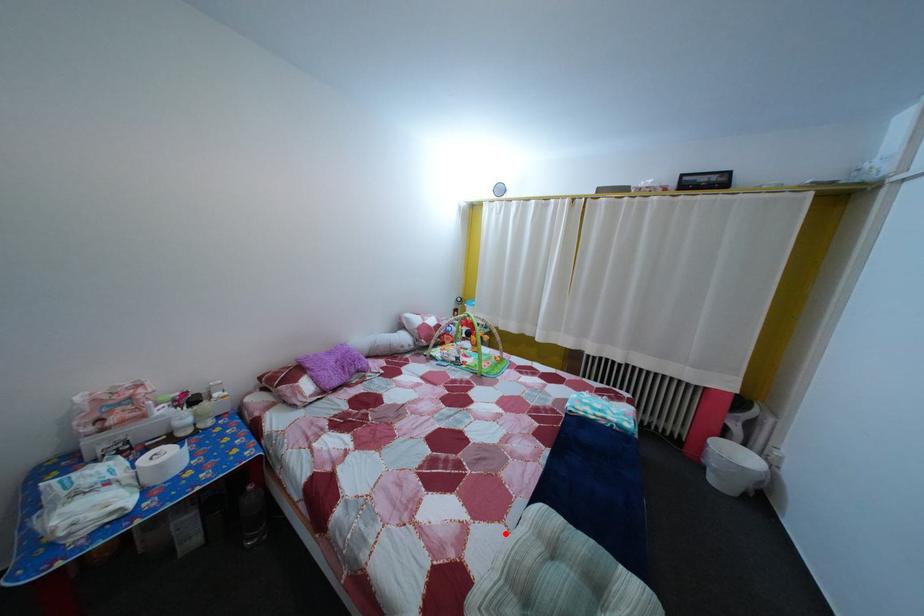
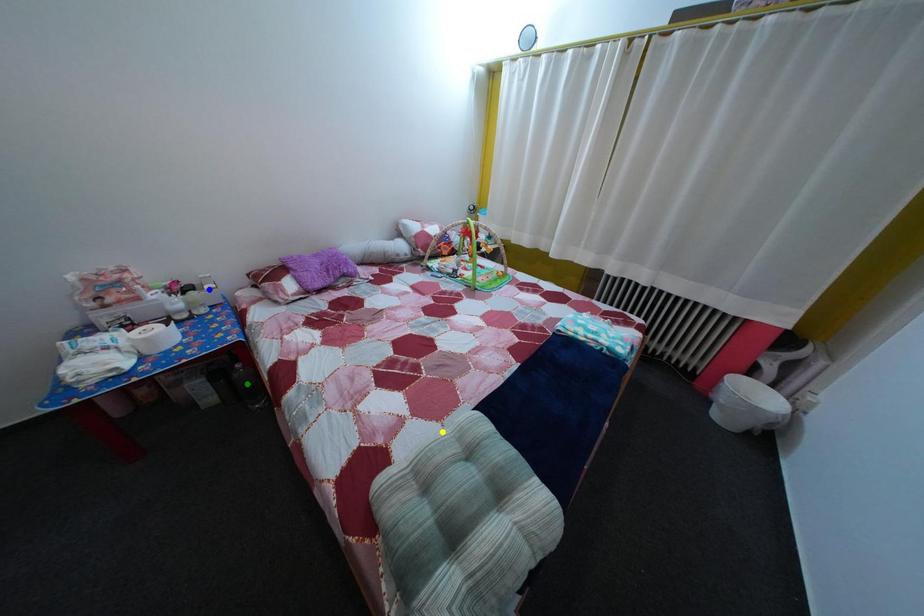
Question: I am providing you with two images of the same scene from different viewpoints. A red point is marked on the first image. You are given multiple points on the second image. Which spot in image 2 lines up with the point in image 1?

Choices:
 (A) blue point
 (B) yellow point
 (C) green point

Answer: (B)